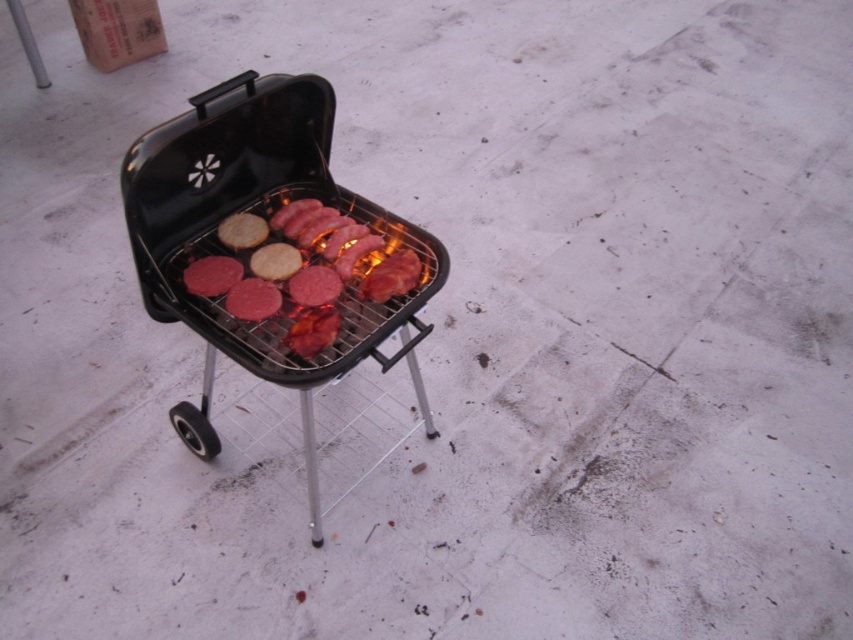
Question: Is pink matte hamburger buns at center bigger than pink matte burger patty at center?

Choices:
 (A) yes
 (B) no

Answer: (A)

Question: Is black matte barbecue grill at center smaller than pink matte burger patty at center?

Choices:
 (A) no
 (B) yes

Answer: (A)

Question: Which object appears farthest from the camera in this image?

Choices:
 (A) pink matte burger patty at center
 (B) pink matte hamburger buns at center
 (C) black matte barbecue grill at center

Answer: (A)

Question: Estimate the real-world distances between objects in this image. Which object is closer to the pink matte hamburger buns at center?

Choices:
 (A) pink matte burger patty at center
 (B) black matte barbecue grill at center

Answer: (B)

Question: Which point appears closest to the camera in this image?

Choices:
 (A) (225, 260)
 (B) (229, 164)
 (C) (332, 244)

Answer: (A)

Question: Is black matte barbecue grill at center below pink matte burger patty at center?

Choices:
 (A) no
 (B) yes

Answer: (B)